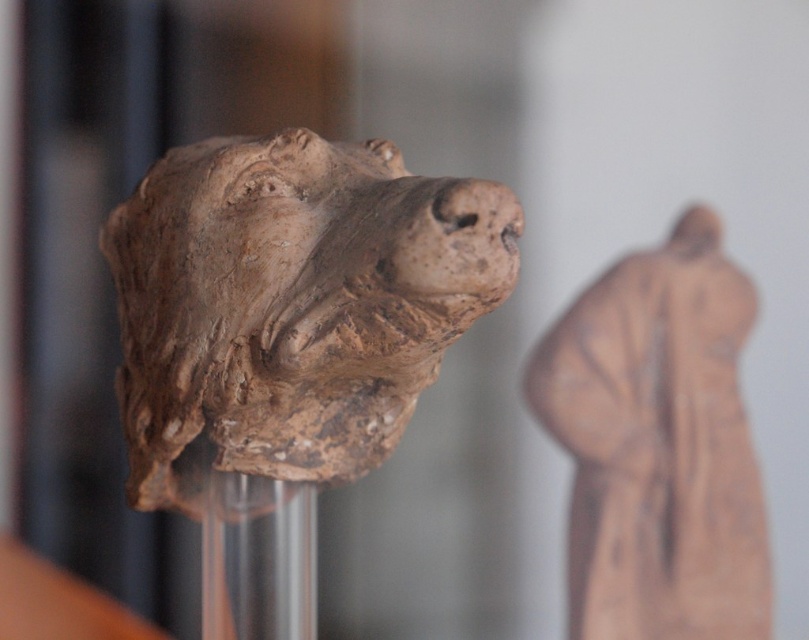
Between point (331, 340) and point (744, 516), which one is positioned behind?

Point (744, 516)

Can you confirm if brown clay head at center is smaller than matte clay figure at center?

No.

Between point (297, 314) and point (668, 483), which one is positioned in front?

Point (297, 314) is more forward.

Identify the location of brown clay head at center. (290, 305).

Which is more to the right, transparent glass vase at center or matte clay head at center?

matte clay head at center is more to the right.

Which is in front, point (280, 609) or point (678, 240)?

Point (280, 609)

You are a GUI agent. You are given a task and a screenshot of the screen. Output one action in this format:
    pyautogui.click(x=<x>, y=<y>)
    Task: Click on the transparent glass vase at center
    Image resolution: width=809 pixels, height=640 pixels.
    Given the screenshot: What is the action you would take?
    pyautogui.click(x=257, y=557)

How distant is matte clay figure at center from transparent glass vase at center?

A distance of 11.91 inches exists between matte clay figure at center and transparent glass vase at center.

Is matte clay figure at center positioned behind transparent glass vase at center?

That is True.

Does point (714, 589) come in front of point (242, 589)?

No, it is not.

Where is `matte clay figure at center`? matte clay figure at center is located at coordinates (657, 452).